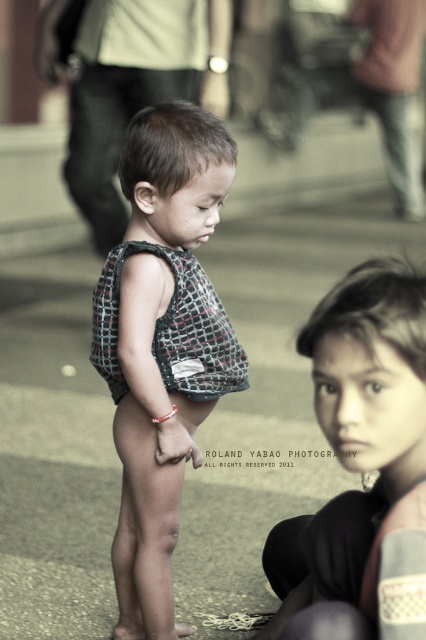
Question: Estimate the real-world distances between objects in this image. Which object is closer to the matte black tank top at center?

Choices:
 (A) textured fabric shirt at center
 (B) gray concrete pavement at center

Answer: (A)

Question: Which point appears farthest from the camera in this image?

Choices:
 (A) (351, 403)
 (B) (178, 502)
 (C) (250, 438)

Answer: (C)

Question: Which object appears closest to the camera in this image?

Choices:
 (A) matte black tank top at center
 (B) gray concrete pavement at center
 (C) textured fabric shirt at center

Answer: (A)

Question: Can you confirm if gray concrete pavement at center is wider than matte black tank top at center?

Choices:
 (A) yes
 (B) no

Answer: (A)

Question: Where is textured fabric shirt at center located in relation to matte black tank top at center in the image?

Choices:
 (A) below
 (B) above

Answer: (B)

Question: Can you confirm if gray concrete pavement at center is positioned below matte black tank top at center?

Choices:
 (A) no
 (B) yes

Answer: (A)